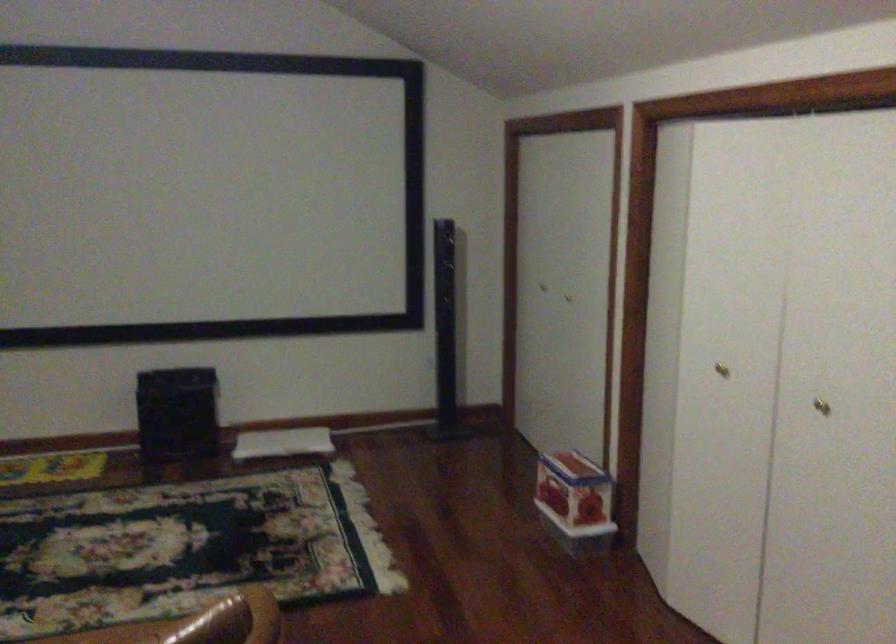
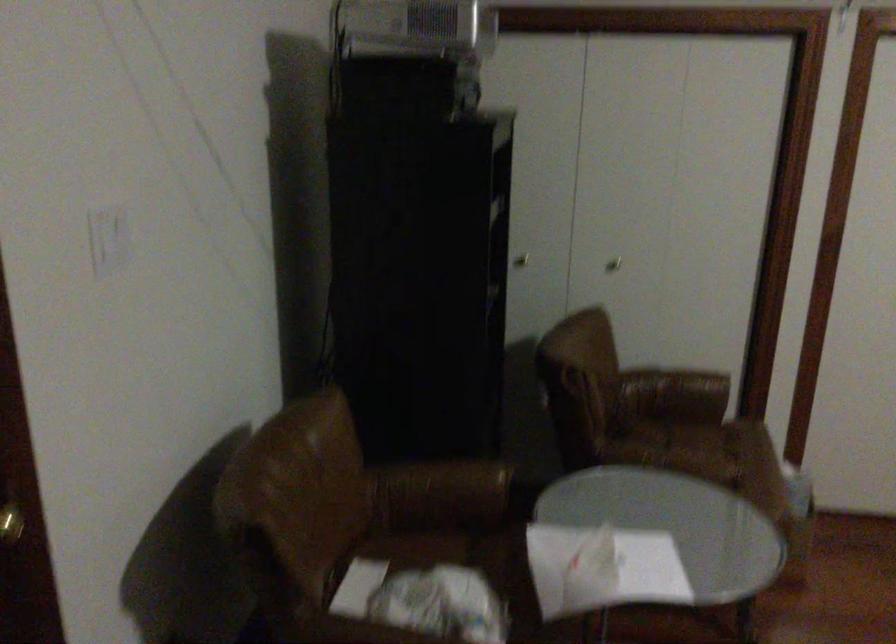
The first image is from the beginning of the video and the second image is from the end. How did the camera likely rotate when shooting the video?

The rotation direction of the camera is left-down.